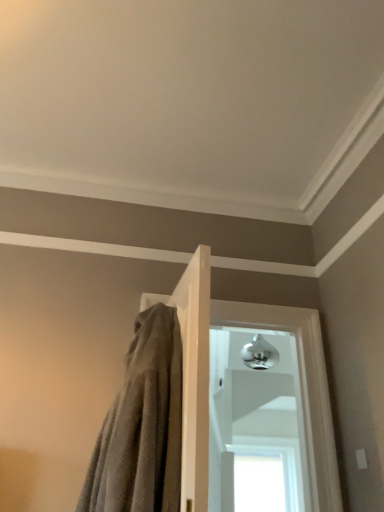
Question: Based on their positions, is polished chrome door handle at center, arranged as the first window when viewed from the top, located to the left or right of gray textured towel at center?

Choices:
 (A) left
 (B) right

Answer: (B)

Question: From the image's perspective, is polished chrome door handle at center, arranged as the first window when viewed from the top, positioned above or below gray textured towel at center?

Choices:
 (A) below
 (B) above

Answer: (A)

Question: Based on their relative distances, which object is nearer to the gray textured towel at center?

Choices:
 (A) transparent glass window at center, positioned as the 2th window in top-to-bottom order
 (B) polished chrome door handle at center, the 2th window ordered from the bottom

Answer: (B)

Question: Which is nearer to the transparent glass window at center, positioned as the 2th window in top-to-bottom order?

Choices:
 (A) gray textured towel at center
 (B) polished chrome door handle at center, arranged as the first window when viewed from the top

Answer: (B)